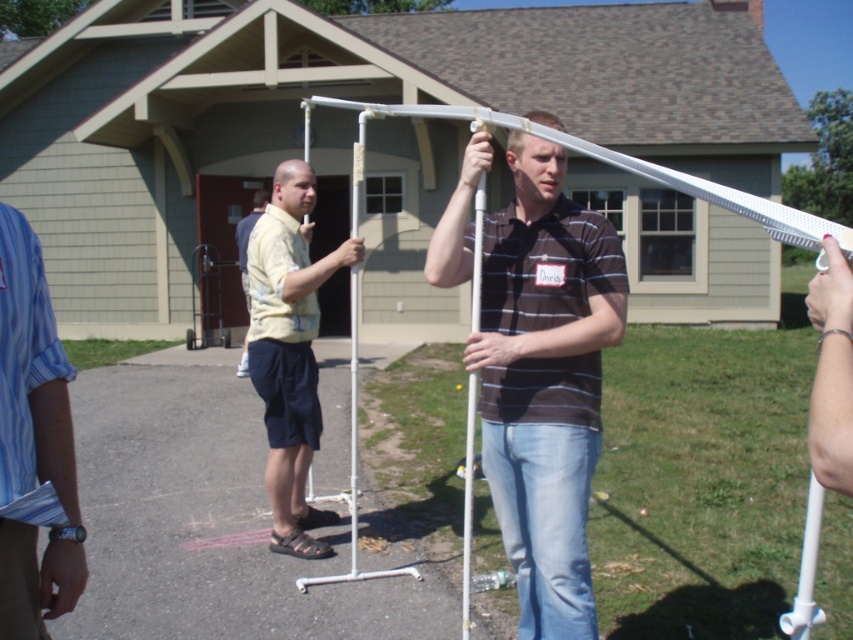
Does blue striped shirt at left have a greater width compared to skinny silver bracelet at upper right?

Yes.

Measure the distance between point (0, 577) and camera.

The distance of point (0, 577) from camera is 1.88 meters.

Does point (54, 372) come farther from viewer compared to point (846, 262)?

Yes, it is.

In order to click on blue striped shirt at left in this screenshot , I will do `click(33, 445)`.

Can you confirm if matte white pole at center is positioned above skinny silver bracelet at upper right?

No.

Is point (546, 444) less distant than point (817, 300)?

No, (546, 444) is behind (817, 300).

Where is `matte white pole at center`? The image size is (853, 640). matte white pole at center is located at coordinates (544, 381).

Is point (4, 348) more distant than point (236, 227)?

No, it is not.

Is point (12, 449) in front of point (252, 220)?

Yes, it is in front of point (252, 220).

Where is `blue striped shirt at left`? blue striped shirt at left is located at coordinates (33, 445).